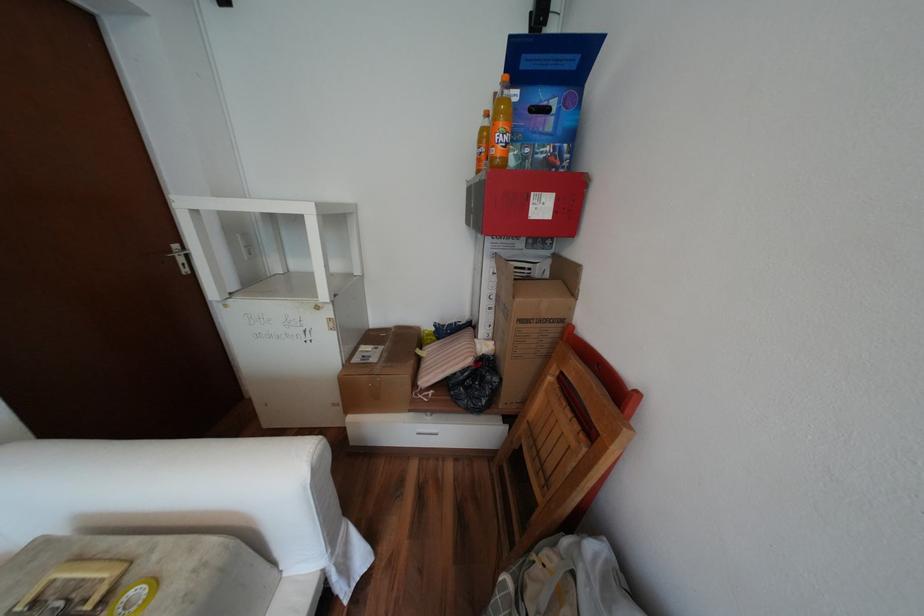
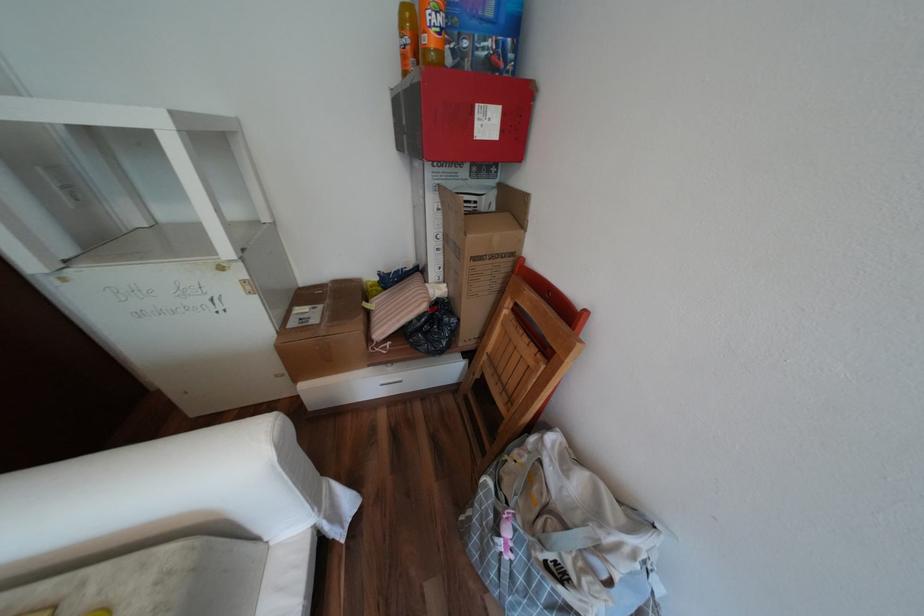
Question: Based on the continuous images, in which direction is the camera rotating? Reply with the corresponding letter.

Choices:
 (A) Left
 (B) Right
 (C) Up
 (D) Down

Answer: (D)